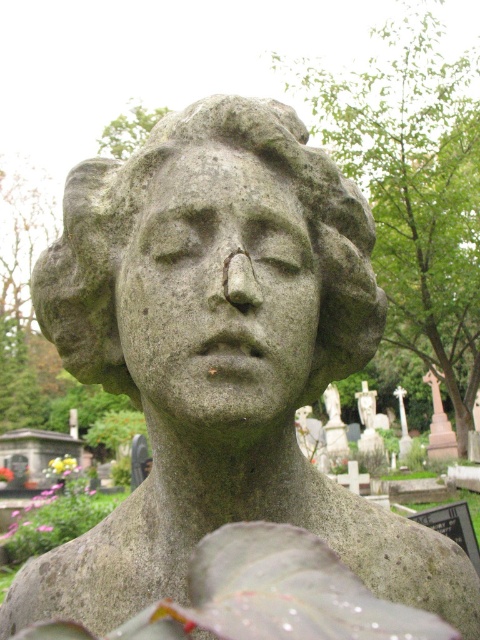
Does gray stone face at center have a smaller size compared to gray stone bust at center?

Yes, gray stone face at center is smaller than gray stone bust at center.

Can you confirm if gray stone face at center is bigger than gray stone bust at center?

Incorrect, gray stone face at center is not larger than gray stone bust at center.

The width and height of the screenshot is (480, 640). In order to click on gray stone face at center in this screenshot , I will do `click(218, 291)`.